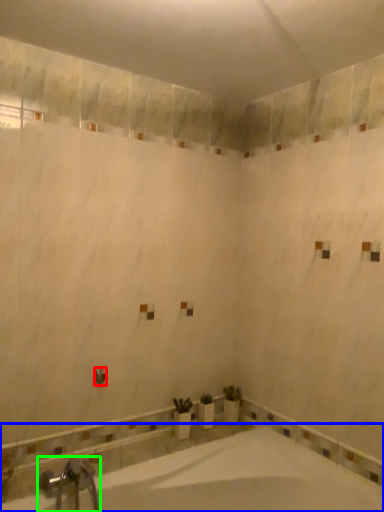
Question: Which object is the farthest from shower (highlighted by a red box)? Choose among these: bathtub (highlighted by a blue box) or tap (highlighted by a green box).

Choices:
 (A) bathtub
 (B) tap

Answer: (A)